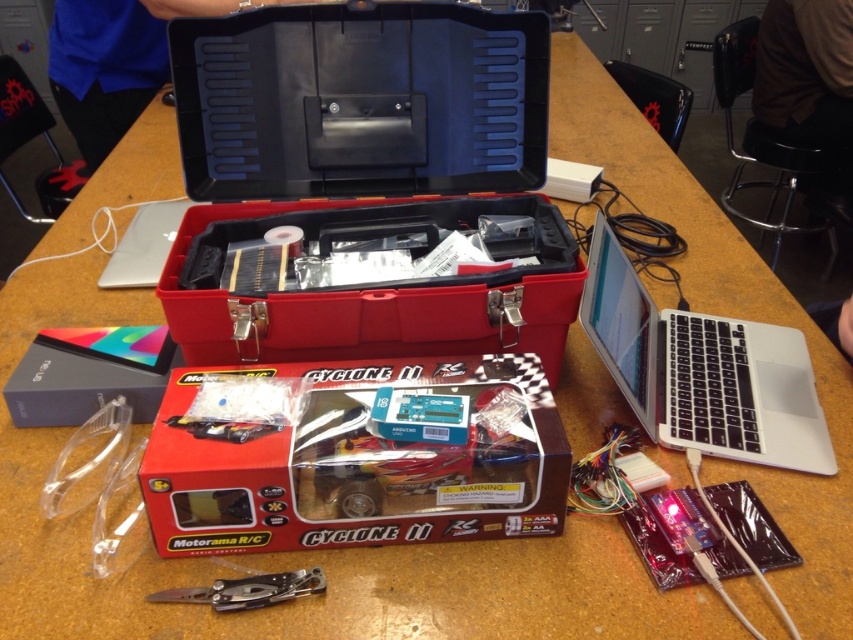
Question: Does silver metallic multi-tool at lower center have a greater width compared to clear plastic toy car at center?

Choices:
 (A) no
 (B) yes

Answer: (B)

Question: Based on their relative distances, which object is nearer to the silver metallic multi-tool at lower center?

Choices:
 (A) silver metallic laptop at right
 (B) red plastic cyclone ii rc car box at center

Answer: (B)

Question: Among these points, which one is nearest to the camera?

Choices:
 (A) (720, 442)
 (B) (271, 602)
 (C) (160, 340)
 (D) (161, 429)

Answer: (B)

Question: Is silver metallic multi-tool at lower center positioned before clear plastic toy car at center?

Choices:
 (A) yes
 (B) no

Answer: (A)

Question: Can you confirm if silver metallic multi-tool at lower center is bigger than clear plastic toy car at center?

Choices:
 (A) yes
 (B) no

Answer: (A)

Question: Which of these objects is positioned farthest from the red plastic cyclone ii rc car box at center?

Choices:
 (A) matte black box at lower left
 (B) clear plastic toy car at center

Answer: (A)